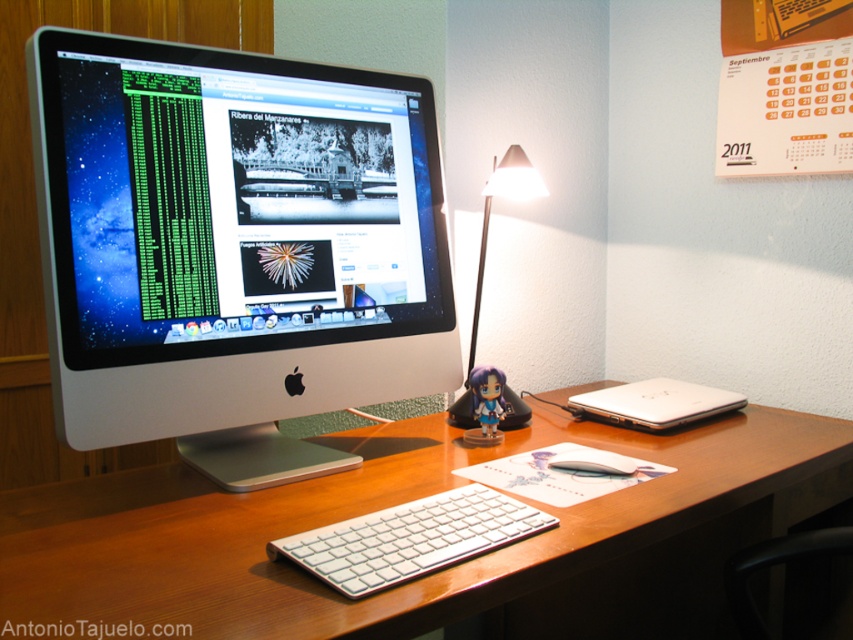
Can you confirm if white wood computer desk at center is positioned above white aluminum keyboard at center?

Incorrect, white wood computer desk at center is not positioned above white aluminum keyboard at center.

Can you confirm if white wood computer desk at center is thinner than white aluminum keyboard at center?

No, white wood computer desk at center is not thinner than white aluminum keyboard at center.

This screenshot has height=640, width=853. What do you see at coordinates (427, 572) in the screenshot?
I see `white wood computer desk at center` at bounding box center [427, 572].

The image size is (853, 640). I want to click on white wood computer desk at center, so click(x=427, y=572).

Is matte plastic figurine at center below white matte mouse at center?

No, matte plastic figurine at center is not below white matte mouse at center.

Does matte plastic figurine at center have a greater width compared to white matte mouse at center?

No.

Find the location of a particular element. matte plastic figurine at center is located at coordinates (486, 404).

Is white aluminum keyboard at center above white matte mouse at center?

Incorrect, white aluminum keyboard at center is not positioned above white matte mouse at center.

Is white aluminum keyboard at center to the right of white matte mouse at center from the viewer's perspective?

No, white aluminum keyboard at center is not to the right of white matte mouse at center.

Is point (422, 568) in front of point (616, 468)?

Yes, point (422, 568) is in front of point (616, 468).

In order to click on white aluminum keyboard at center in this screenshot , I will do `click(409, 538)`.